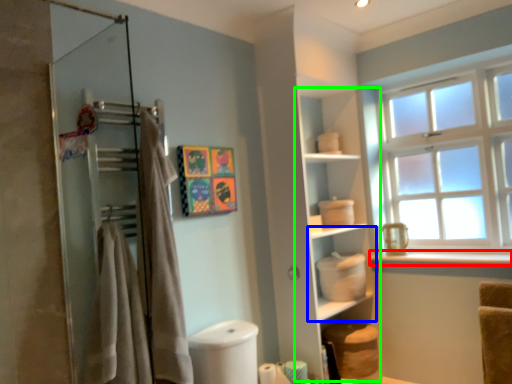
Question: Based on their relative distances, which object is farther from window sill (highlighted by a red box)? Choose from shelf (highlighted by a blue box) and cabinet (highlighted by a green box).

Choices:
 (A) shelf
 (B) cabinet

Answer: (B)